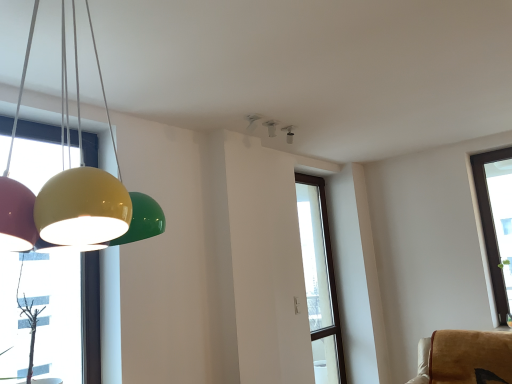
Question: From the image's perspective, is transparent glass window at center under white glossy light fixture at upper center, marked as the first lamp in a right-to-left arrangement?

Choices:
 (A) no
 (B) yes

Answer: (B)

Question: Can you confirm if transparent glass window at center is smaller than white glossy light fixture at upper center, positioned as the second lamp in bottom-to-top order?

Choices:
 (A) yes
 (B) no

Answer: (B)

Question: Could you tell me if transparent glass window at center is facing white glossy light fixture at upper center, marked as the 1th lamp in a top-to-bottom arrangement?

Choices:
 (A) no
 (B) yes

Answer: (A)

Question: Can you confirm if transparent glass window at center is bigger than white glossy light fixture at upper center, positioned as the second lamp in front-to-back order?

Choices:
 (A) no
 (B) yes

Answer: (B)

Question: Is transparent glass window at center facing away from white glossy light fixture at upper center, positioned as the second lamp in bottom-to-top order?

Choices:
 (A) no
 (B) yes

Answer: (A)

Question: In the image, is white glossy light fixture at upper center, marked as the 1th lamp in a top-to-bottom arrangement, positioned in front of or behind transparent glass window at center?

Choices:
 (A) behind
 (B) front

Answer: (B)

Question: Is white glossy light fixture at upper center, which ranks as the first lamp in back-to-front order, situated inside transparent glass window at center or outside?

Choices:
 (A) outside
 (B) inside

Answer: (A)

Question: Is white glossy light fixture at upper center, marked as the 1th lamp in a top-to-bottom arrangement, to the left or to the right of transparent glass window at center in the image?

Choices:
 (A) left
 (B) right

Answer: (A)

Question: From the image's perspective, relative to transparent glass window at center, is white glossy light fixture at upper center, positioned as the second lamp in front-to-back order, above or below?

Choices:
 (A) above
 (B) below

Answer: (A)

Question: Is glossy plastic lampshade at left, the first lamp viewed from the front, taller or shorter than transparent glass window at center?

Choices:
 (A) tall
 (B) short

Answer: (B)

Question: Do you think glossy plastic lampshade at left, the 2th lamp viewed from the back, is within transparent glass window at center, or outside of it?

Choices:
 (A) inside
 (B) outside

Answer: (B)

Question: Visually, is glossy plastic lampshade at left, the 1th lamp ordered from the bottom, positioned to the left or to the right of transparent glass window at center?

Choices:
 (A) left
 (B) right

Answer: (A)

Question: Considering the positions of glossy plastic lampshade at left, arranged as the first lamp when viewed from the left, and transparent glass window at center in the image, is glossy plastic lampshade at left, arranged as the first lamp when viewed from the left, wider or thinner than transparent glass window at center?

Choices:
 (A) thin
 (B) wide

Answer: (B)

Question: Is transparent glass window at center spatially inside white glossy light fixture at upper center, positioned as the second lamp in bottom-to-top order, or outside of it?

Choices:
 (A) outside
 (B) inside

Answer: (A)

Question: In the image, is transparent glass window at center on the left side or the right side of white glossy light fixture at upper center, positioned as the second lamp in front-to-back order?

Choices:
 (A) right
 (B) left

Answer: (A)